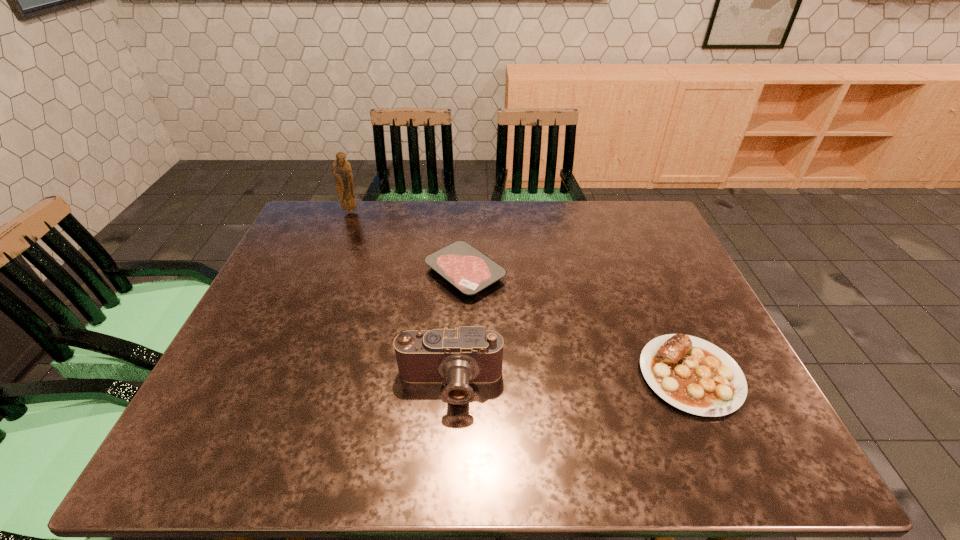
You are a GUI agent. You are given a task and a screenshot of the screen. Output one action in this format:
    pyautogui.click(x=<x>, y=<y>)
    Task: Click on the vacant position in the image that satisfies the following two spatial constraints: 1. on the front side of the second farthest object; 2. on the right side of the right steak
    The image size is (960, 540).
    Given the screenshot: What is the action you would take?
    pyautogui.click(x=461, y=375)

Locate an element on the screen. This screenshot has width=960, height=540. free space that satisfies the following two spatial constraints: 1. on the front-facing side of the second shortest object; 2. on the left side of the farthest object is located at coordinates (285, 375).

I want to click on vacant area that satisfies the following two spatial constraints: 1. on the front-facing side of the figurine; 2. on the left side of the left steak, so click(326, 273).

You are a GUI agent. You are given a task and a screenshot of the screen. Output one action in this format:
    pyautogui.click(x=<x>, y=<y>)
    Task: Click on the vacant space that satisfies the following two spatial constraints: 1. on the front-facing side of the leftmost object; 2. on the right side of the second shortest object
    Image resolution: width=960 pixels, height=540 pixels.
    Given the screenshot: What is the action you would take?
    pyautogui.click(x=285, y=375)

Where is `vacant space that satisfies the following two spatial constraints: 1. on the front-facing side of the second farthest object; 2. on the left side of the farthest object`? vacant space that satisfies the following two spatial constraints: 1. on the front-facing side of the second farthest object; 2. on the left side of the farthest object is located at coordinates (326, 273).

Identify the location of vacant region that satisfies the following two spatial constraints: 1. on the front-facing side of the leftmost object; 2. on the right side of the shortest object. (326, 273).